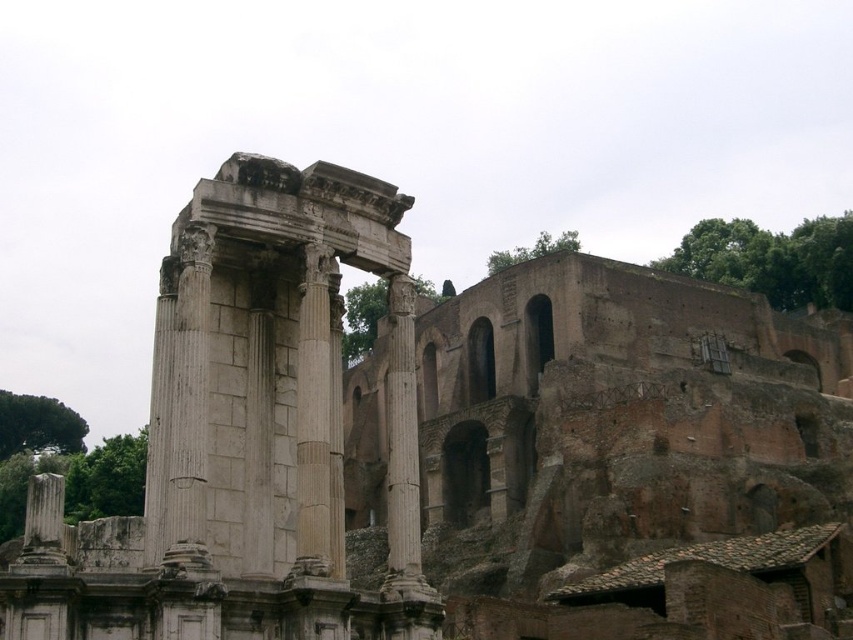
Question: Which object is closer to the camera taking this photo?

Choices:
 (A) white marble column at center
 (B) smooth stone column at center

Answer: (A)

Question: Observing the image, what is the correct spatial positioning of white marble column at center in reference to smooth stone column at center?

Choices:
 (A) right
 (B) left

Answer: (B)

Question: Observing the image, what is the correct spatial positioning of white marble column at center in reference to smooth stone column at center?

Choices:
 (A) right
 (B) left

Answer: (B)

Question: Which of the following is the closest to the observer?

Choices:
 (A) white marble column at center
 (B) smooth stone column at center

Answer: (A)

Question: Which of the following is the farthest from the observer?

Choices:
 (A) white marble column at center
 (B) smooth stone column at center

Answer: (B)

Question: Can you confirm if white marble column at center is thinner than smooth stone column at center?

Choices:
 (A) no
 (B) yes

Answer: (B)